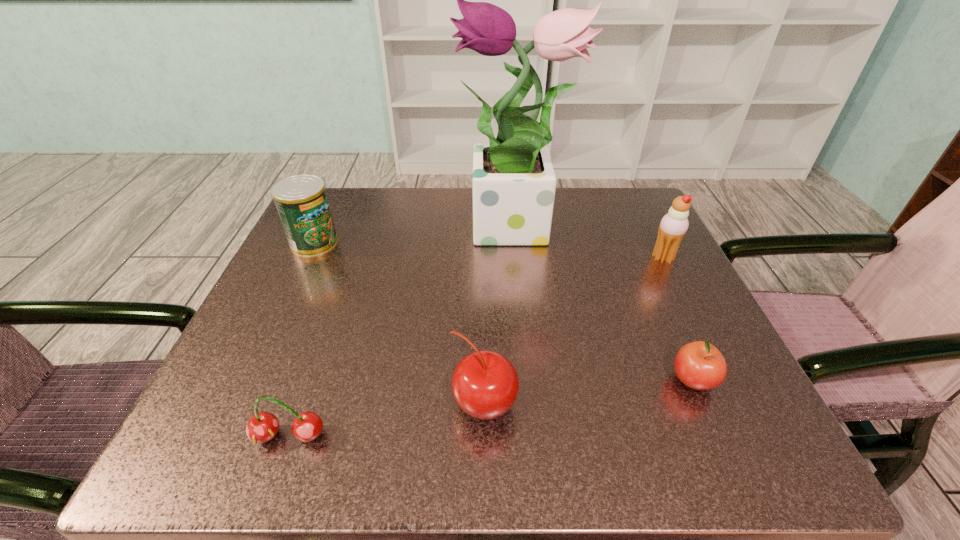
The image size is (960, 540). Find the location of `icecream that is at the right edge`. icecream that is at the right edge is located at coordinates (673, 226).

What are the coordinates of `apple that is positioned at the right edge` in the screenshot? It's located at (699, 365).

In order to click on object at the far left corner in this screenshot , I will do `click(301, 200)`.

Locate an element on the screen. The image size is (960, 540). object located at the near left corner is located at coordinates (262, 427).

Where is `vacant area at the far edge of the desktop`? vacant area at the far edge of the desktop is located at coordinates (466, 210).

What are the coordinates of `vacant region at the left edge of the desktop` in the screenshot? It's located at (279, 323).

In the image, there is a desktop. What are the coordinates of `vacant space at the right edge` in the screenshot? It's located at (675, 330).

Find the location of a particular element. This screenshot has width=960, height=540. vacant space at the far left corner of the desktop is located at coordinates (358, 227).

Where is `vacant space at the far right corner of the desktop`? vacant space at the far right corner of the desktop is located at coordinates (655, 216).

You are a GUI agent. You are given a task and a screenshot of the screen. Output one action in this format:
    pyautogui.click(x=<x>, y=<y>)
    Task: Click on the vacant space at the near right corner of the desktop
    The image size is (960, 540).
    Given the screenshot: What is the action you would take?
    pyautogui.click(x=728, y=444)